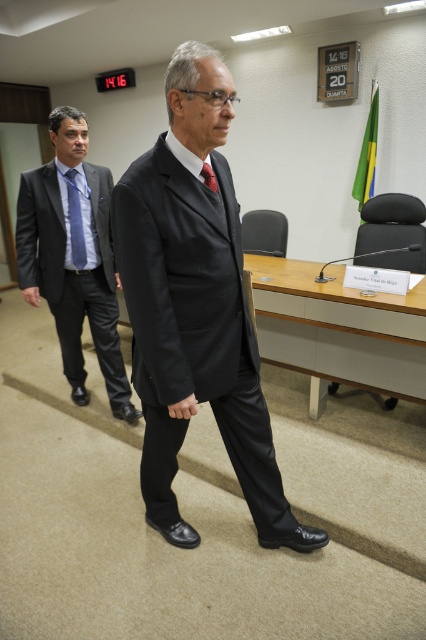
Is matte black suit at left to the right of red silk tie at center from the viewer's perspective?

No, matte black suit at left is not to the right of red silk tie at center.

Based on the photo, does matte black suit at left have a greater width compared to red silk tie at center?

Indeed, matte black suit at left has a greater width compared to red silk tie at center.

Locate an element on the screen. matte black suit at left is located at coordinates (74, 257).

Where is `matte black suit at left`? Image resolution: width=426 pixels, height=640 pixels. matte black suit at left is located at coordinates (74, 257).

Is matte black suit at center to the left of red silk tie at center from the viewer's perspective?

In fact, matte black suit at center is to the right of red silk tie at center.

Is matte black suit at center positioned before red silk tie at center?

Yes.

Is point (204, 68) farther from camera compared to point (215, 184)?

No, it is in front of (215, 184).

You are a GUI agent. You are given a task and a screenshot of the screen. Output one action in this format:
    pyautogui.click(x=<x>, y=<y>)
    Task: Click on the matte black suit at center
    This screenshot has width=426, height=640.
    Given the screenshot: What is the action you would take?
    pyautogui.click(x=195, y=307)

Is matte black suit at center positioned behind blue striped tie at left?

No, matte black suit at center is in front of blue striped tie at left.

Is matte black suit at center to the right of blue striped tie at left from the viewer's perspective?

Correct, you'll find matte black suit at center to the right of blue striped tie at left.

Locate an element on the screen. matte black suit at center is located at coordinates (195, 307).